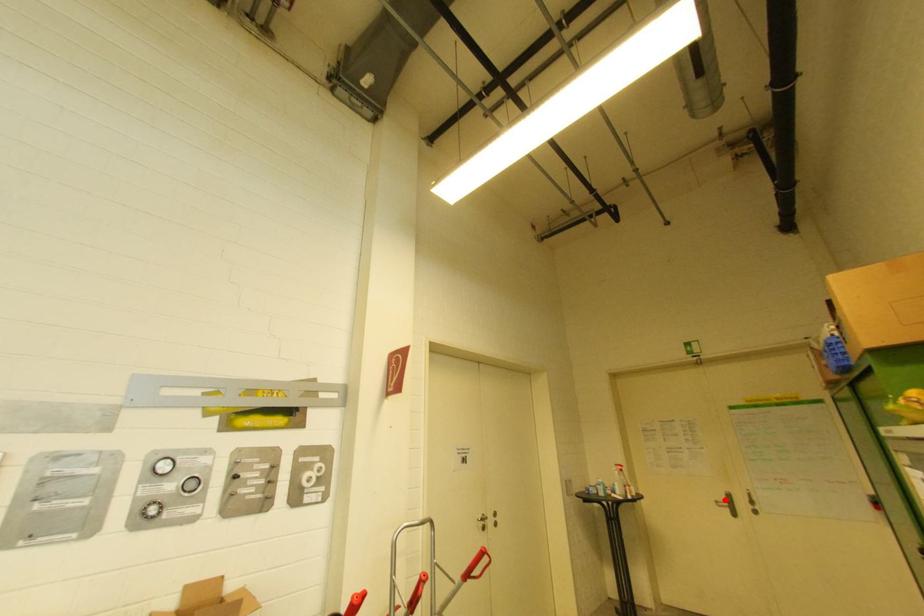
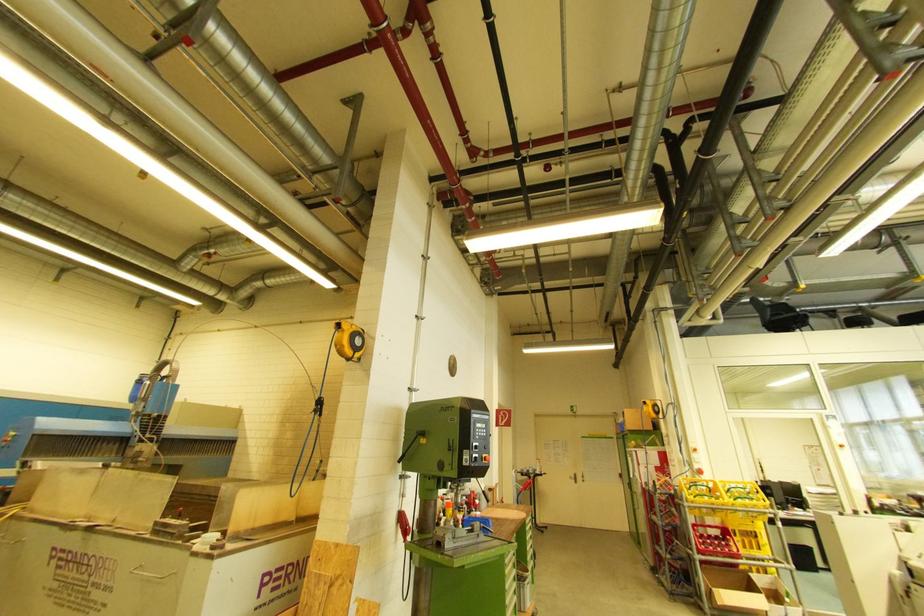
In the second image, find the point that corresponds to the highlighted location in the first image.

(575, 477)